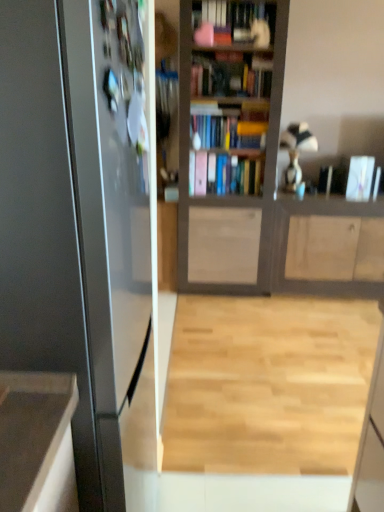
Question: Does light wood floor at center have a lesser height compared to white glossy book at upper right, which is the 1th book from right to left?

Choices:
 (A) yes
 (B) no

Answer: (A)

Question: From a real-world perspective, is light wood floor at center positioned under white glossy book at upper right, which is the 1th book from right to left, based on gravity?

Choices:
 (A) no
 (B) yes

Answer: (B)

Question: Does light wood floor at center have a greater height compared to white glossy book at upper right, which is the 2th book from left to right?

Choices:
 (A) no
 (B) yes

Answer: (A)

Question: Is light wood floor at center directly adjacent to white glossy book at upper right, which is the 1th book from right to left?

Choices:
 (A) yes
 (B) no

Answer: (B)

Question: Is light wood floor at center bigger than white glossy book at upper right, which is the 2th book from left to right?

Choices:
 (A) yes
 (B) no

Answer: (A)

Question: Is light wood floor at center looking in the opposite direction of white glossy book at upper right, which is the 1th book from right to left?

Choices:
 (A) no
 (B) yes

Answer: (A)

Question: Is metallic refrigerator at left thinner than white glossy book at upper right, which is the 2th book from left to right?

Choices:
 (A) yes
 (B) no

Answer: (B)

Question: Can white glossy book at upper right, which is the 2th book from left to right, be found inside metallic refrigerator at left?

Choices:
 (A) no
 (B) yes

Answer: (A)

Question: Does metallic refrigerator at left have a greater height compared to white glossy book at upper right, which is the 1th book from right to left?

Choices:
 (A) no
 (B) yes

Answer: (B)

Question: Is metallic refrigerator at left with white glossy book at upper right, which is the 1th book from right to left?

Choices:
 (A) no
 (B) yes

Answer: (A)

Question: Is the position of metallic refrigerator at left less distant than that of white glossy book at upper right, which is the 1th book from right to left?

Choices:
 (A) yes
 (B) no

Answer: (A)

Question: Is metallic refrigerator at left to the right of white glossy book at upper right, which is the 2th book from left to right, from the viewer's perspective?

Choices:
 (A) yes
 (B) no

Answer: (B)

Question: Does light wood floor at center turn towards wooden cabinet at center?

Choices:
 (A) yes
 (B) no

Answer: (B)